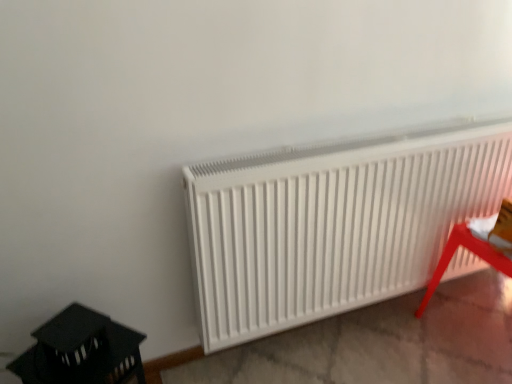
Question: Would you consider white matte radiator at center to be distant from metallic red stool at lower right, which is the second furniture in left-to-right order?

Choices:
 (A) yes
 (B) no

Answer: (B)

Question: From the image's perspective, would you say white matte radiator at center is positioned over metallic red stool at lower right, which is the second furniture in left-to-right order?

Choices:
 (A) yes
 (B) no

Answer: (A)

Question: Are white matte radiator at center and metallic red stool at lower right, which is the second furniture in left-to-right order, making contact?

Choices:
 (A) yes
 (B) no

Answer: (B)

Question: Is white matte radiator at center taller than metallic red stool at lower right, which is the second furniture in left-to-right order?

Choices:
 (A) yes
 (B) no

Answer: (A)

Question: Is white matte radiator at center turned away from metallic red stool at lower right, which is the second furniture in left-to-right order?

Choices:
 (A) no
 (B) yes

Answer: (A)

Question: Considering the positions of metallic red stool at lower right, which is counted as the 1th furniture, starting from the right, and black plastic lantern at lower left, which is the second furniture from right to left, in the image, is metallic red stool at lower right, which is counted as the 1th furniture, starting from the right, taller or shorter than black plastic lantern at lower left, which is the second furniture from right to left,?

Choices:
 (A) short
 (B) tall

Answer: (A)

Question: Relative to black plastic lantern at lower left, which is the second furniture from right to left, is metallic red stool at lower right, which is the second furniture in left-to-right order, in front or behind?

Choices:
 (A) front
 (B) behind

Answer: (B)

Question: Looking at their shapes, would you say metallic red stool at lower right, which is the second furniture in left-to-right order, is wider or thinner than black plastic lantern at lower left, which appears as the 1th furniture when viewed from the left?

Choices:
 (A) thin
 (B) wide

Answer: (B)

Question: Does point click(x=454, y=241) appear closer or farther from the camera than point click(x=134, y=357)?

Choices:
 (A) farther
 (B) closer

Answer: (A)

Question: Which is correct: metallic red stool at lower right, which is the second furniture in left-to-right order, is inside white matte radiator at center, or outside of it?

Choices:
 (A) inside
 (B) outside

Answer: (B)

Question: Considering the positions of metallic red stool at lower right, which is counted as the 1th furniture, starting from the right, and white matte radiator at center in the image, is metallic red stool at lower right, which is counted as the 1th furniture, starting from the right, taller or shorter than white matte radiator at center?

Choices:
 (A) tall
 (B) short

Answer: (B)

Question: In the image, is metallic red stool at lower right, which is counted as the 1th furniture, starting from the right, positioned in front of or behind white matte radiator at center?

Choices:
 (A) front
 (B) behind

Answer: (B)

Question: From a real-world perspective, relative to white matte radiator at center, is metallic red stool at lower right, which is the second furniture in left-to-right order, vertically above or below?

Choices:
 (A) above
 (B) below

Answer: (B)

Question: Considering the positions of white matte radiator at center and metallic red stool at lower right, which is the second furniture in left-to-right order, in the image, is white matte radiator at center wider or thinner than metallic red stool at lower right, which is the second furniture in left-to-right order,?

Choices:
 (A) wide
 (B) thin

Answer: (B)

Question: Is point (303, 208) positioned closer to the camera than point (472, 238)?

Choices:
 (A) closer
 (B) farther

Answer: (A)